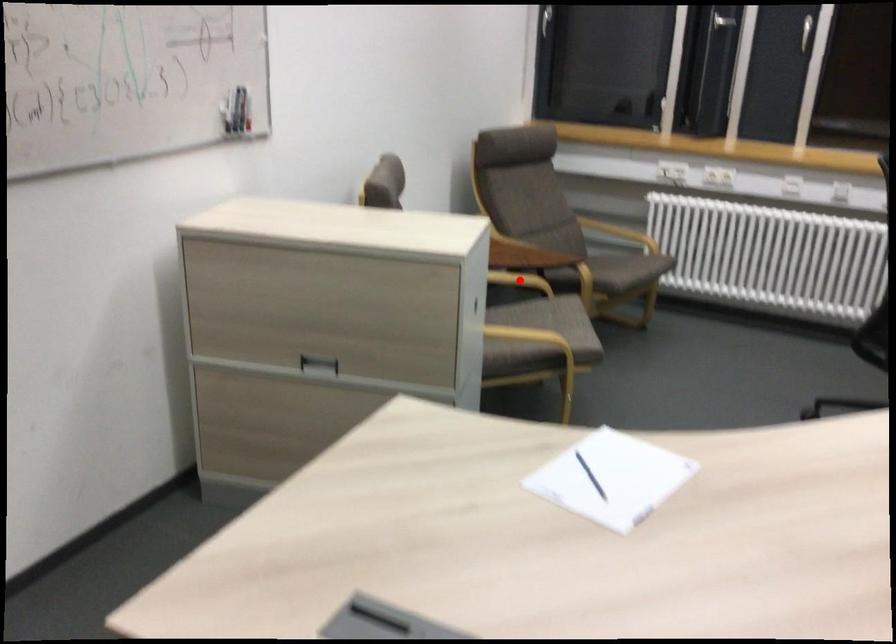
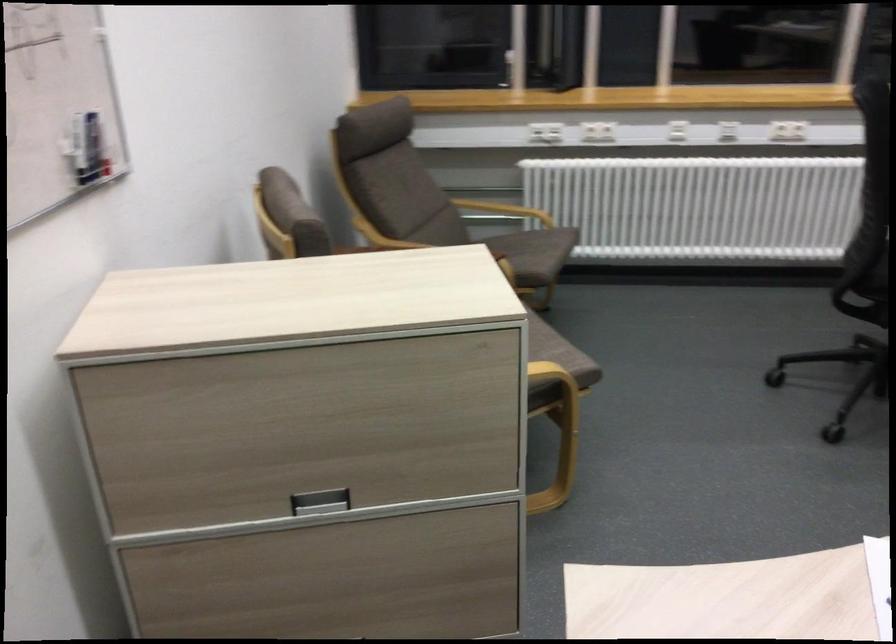
Question: I am providing you with two images of the same scene from different viewpoints. A red point is marked on the first image. At the location where the point appears in image 1, is it still visible in image 2?

Choices:
 (A) Yes
 (B) No

Answer: (B)